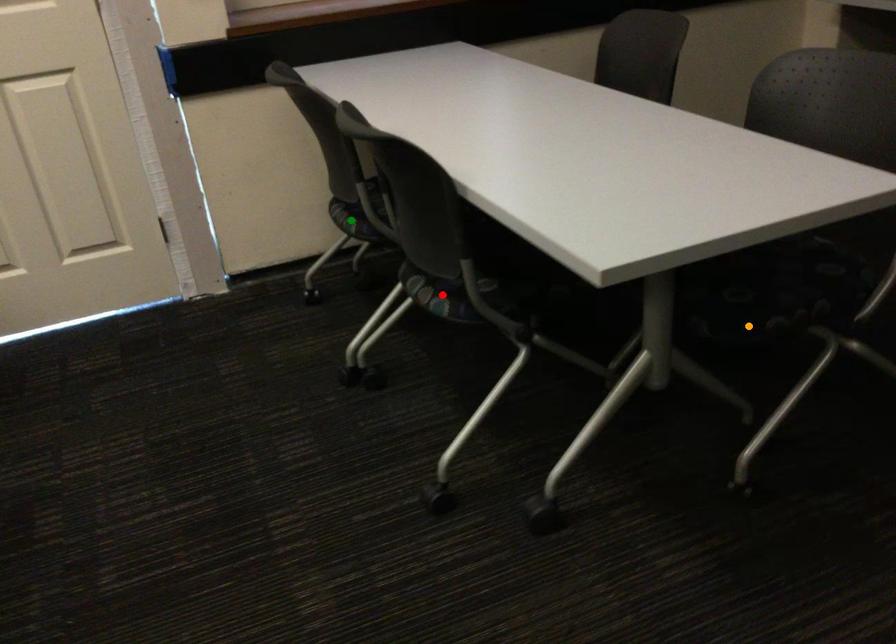
Order these from nearest to farthest:
1. orange point
2. green point
3. red point

1. green point
2. red point
3. orange point